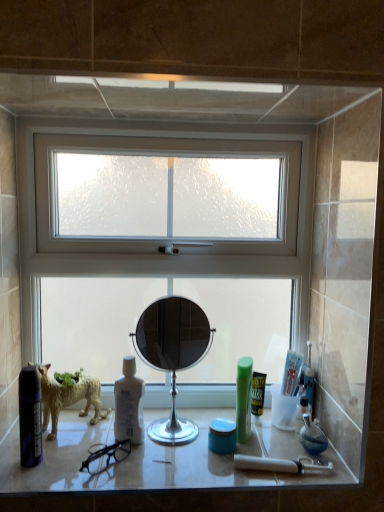
The width and height of the screenshot is (384, 512). I want to click on free spot above white frosted glass window at center (from a real-world perspective), so click(x=171, y=119).